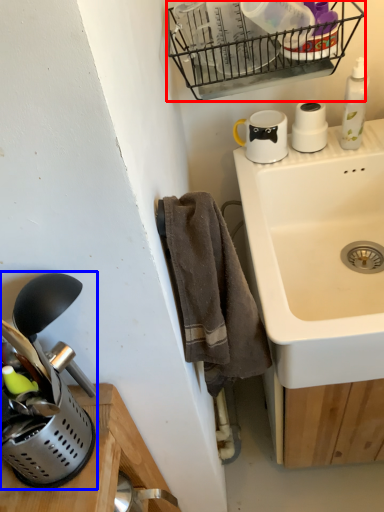
Question: Which point is closer to the camera, basket (highlighted by a red box) or appliance (highlighted by a blue box)?

Choices:
 (A) basket
 (B) appliance

Answer: (B)